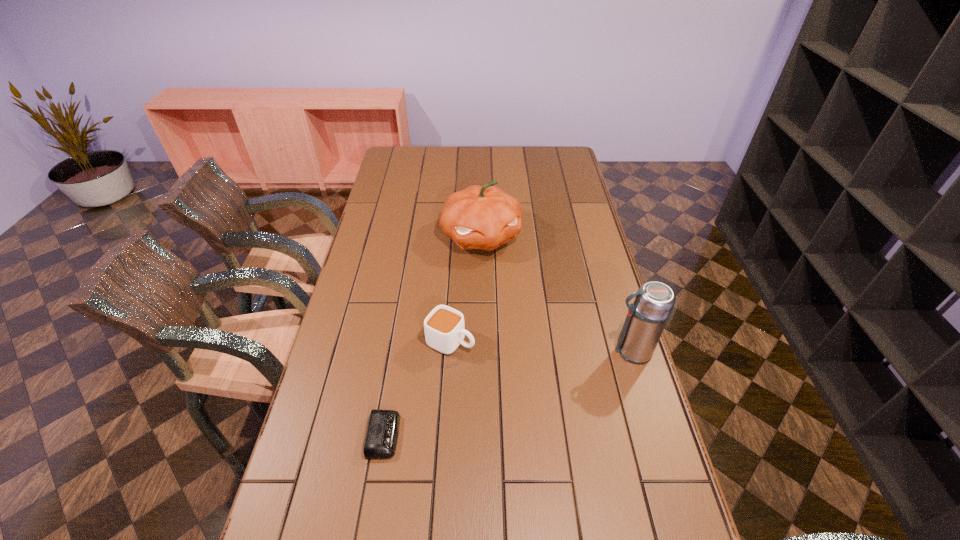
You are a GUI agent. You are given a task and a screenshot of the screen. Output one action in this format:
    pyautogui.click(x=<x>, y=<y>)
    Task: Click on the free space on the desktop that is between the alarm clock and the thermos bottle and is positioned on the front face of the farthest object
    
    Given the screenshot: What is the action you would take?
    pyautogui.click(x=546, y=380)

I want to click on free space on the desktop that is between the shortest object and the thermos bottle and is positioned on the side with the handle of the second shortest object, so pyautogui.click(x=538, y=383).